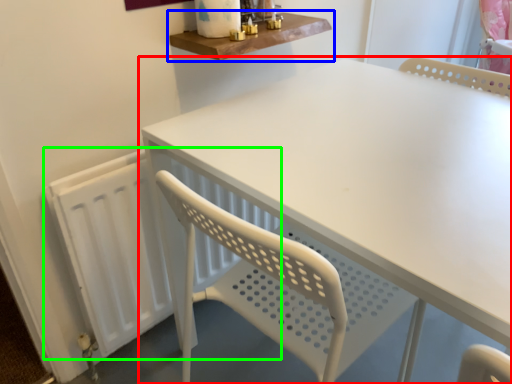
Question: Which object is positioned farthest from table (highlighted by a red box)? Select from shelf (highlighted by a blue box) and radiator (highlighted by a green box).

Choices:
 (A) shelf
 (B) radiator

Answer: (B)